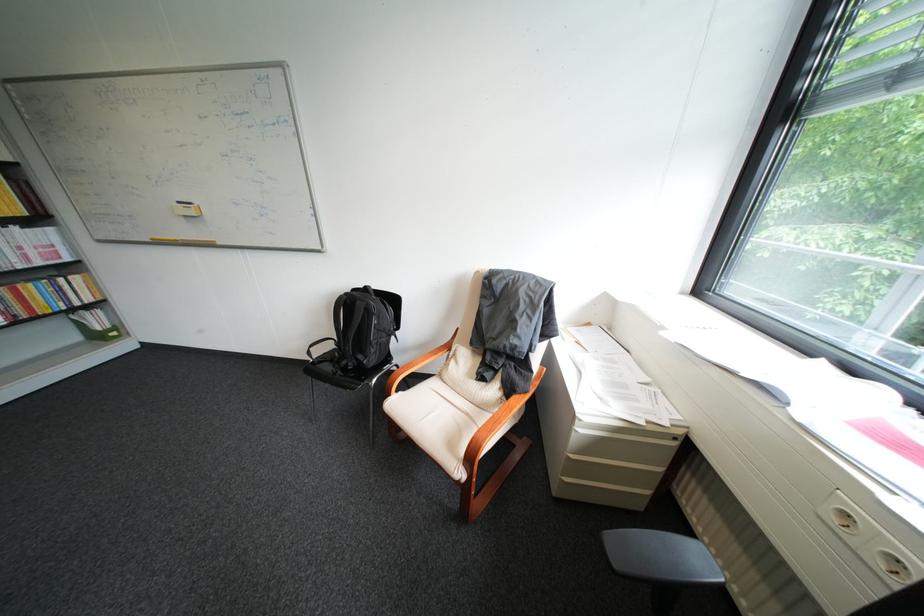
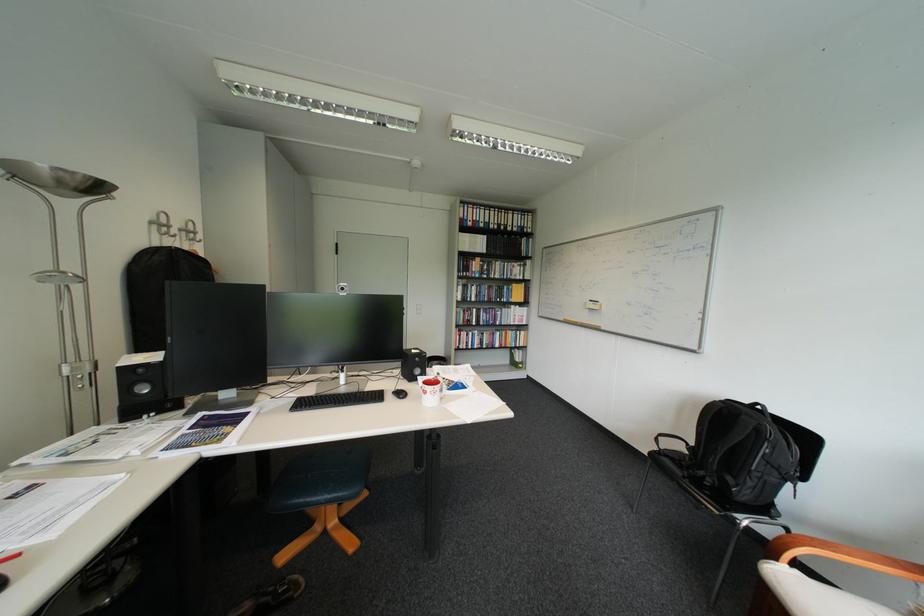
In the second image, find the point that corresponds to pixel 399 406 in the first image.

(783, 572)